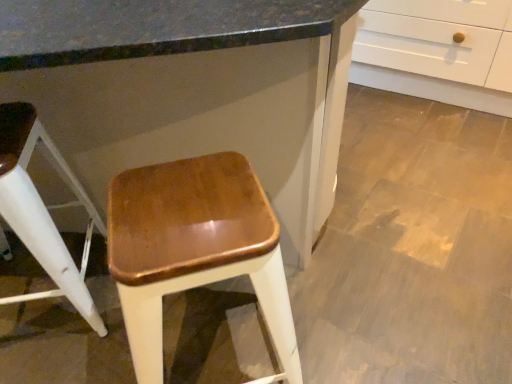
Question: Would you say white glossy cabinet at upper right is to the left or to the right of shiny brown wood stool at center, placed as the 2th stool when sorted from right to left, in the picture?

Choices:
 (A) left
 (B) right

Answer: (A)

Question: Considering the positions of white glossy cabinet at upper right and shiny brown wood stool at center, placed as the 2th stool when sorted from right to left, in the image, is white glossy cabinet at upper right bigger or smaller than shiny brown wood stool at center, placed as the 2th stool when sorted from right to left,?

Choices:
 (A) small
 (B) big

Answer: (B)

Question: Which of these objects is positioned farthest from the white glossy cabinet at upper right?

Choices:
 (A) shiny brown wood stool at center, acting as the 1th stool starting from the left
 (B) glossy wood stool at center, positioned as the 2th stool in left-to-right order

Answer: (A)

Question: Which object is positioned farthest from the shiny brown wood stool at center, acting as the 1th stool starting from the left?

Choices:
 (A) white glossy cabinet at upper right
 (B) glossy wood stool at center, positioned as the 2th stool in left-to-right order

Answer: (B)